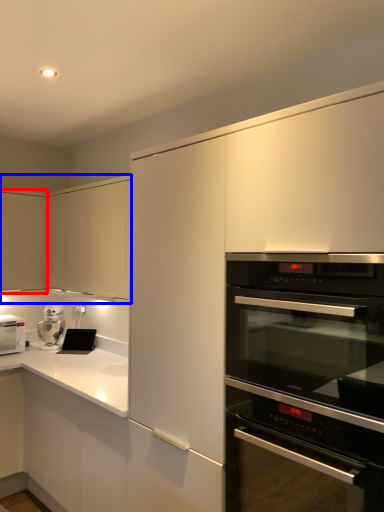
Question: Among these objects, which one is farthest to the camera, cabinetry (highlighted by a red box) or cabinetry (highlighted by a blue box)?

Choices:
 (A) cabinetry
 (B) cabinetry

Answer: (A)